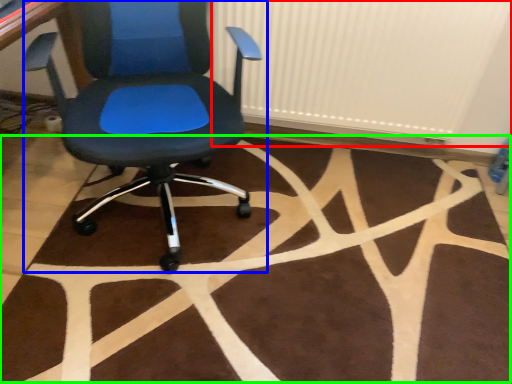
Question: Based on their relative distances, which object is farther from radiator (highlighted by a red box)? Choose from chair (highlighted by a blue box) and mat (highlighted by a green box).

Choices:
 (A) chair
 (B) mat

Answer: (B)